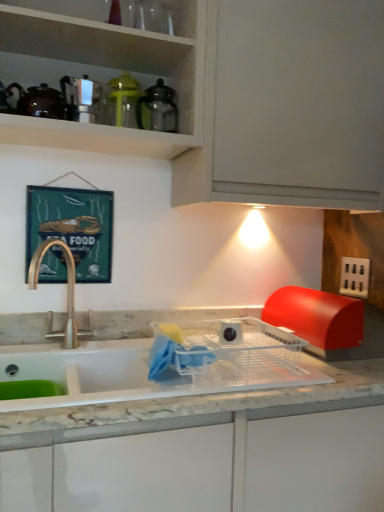
What do you see at coordinates (158, 108) in the screenshot?
I see `transparent glass pitcher at upper center, the third appliance positioned from the left` at bounding box center [158, 108].

Measure the distance between satin nickel soap dispenser at upper left, the 1th appliance when ordered from left to right, and camera.

satin nickel soap dispenser at upper left, the 1th appliance when ordered from left to right, is 4.12 feet from camera.

Locate an element on the screen. The height and width of the screenshot is (512, 384). translucent yellow pitcher at upper center, the second appliance positioned from the right is located at coordinates pos(123,101).

The height and width of the screenshot is (512, 384). What do you see at coordinates (147, 369) in the screenshot?
I see `white glossy sink at center` at bounding box center [147, 369].

Identify the location of matte brown teapot at upper left. Image resolution: width=384 pixels, height=512 pixels. (39, 101).

At what (x,y) coordinates should I click in order to perform the action: click on transparent glass pitcher at upper center, the third appliance positioned from the left. Please return your answer as a coordinate pair (x, y). The image size is (384, 512). Looking at the image, I should click on (158, 108).

Is white matte cabinet at upper center positioned with its back to transparent glass pitcher at upper center, the third appliance positioned from the left?

Yes.

Is white matte cabinet at upper center positioned far away from transparent glass pitcher at upper center, which is the 1th appliance from right to left?

No, there isn't a large distance between white matte cabinet at upper center and transparent glass pitcher at upper center, which is the 1th appliance from right to left.

Can you confirm if white matte cabinet at upper center is thinner than transparent glass pitcher at upper center, which is the 1th appliance from right to left?

Incorrect, the width of white matte cabinet at upper center is not less than that of transparent glass pitcher at upper center, which is the 1th appliance from right to left.

Based on their positions, is black plastic electric outlet at right located to the left or right of matte brown teapot at upper left?

From the image, it's evident that black plastic electric outlet at right is to the right of matte brown teapot at upper left.

The width and height of the screenshot is (384, 512). In order to click on electric outlet located on the right of matte brown teapot at upper left in this screenshot , I will do `click(354, 277)`.

Consider the image. Can you see black plastic electric outlet at right touching matte brown teapot at upper left?

No, black plastic electric outlet at right is not next to matte brown teapot at upper left.

From a real-world perspective, who is located higher, black plastic electric outlet at right or matte brown teapot at upper left?

From a 3D spatial view, matte brown teapot at upper left is above.

Is white matte cabinet at upper center next to satin nickel soap dispenser at upper left, the 1th appliance when ordered from left to right, and touching it?

No, white matte cabinet at upper center is not touching satin nickel soap dispenser at upper left, the 1th appliance when ordered from left to right.

Who is smaller, white matte cabinet at upper center or satin nickel soap dispenser at upper left, the 3th appliance in the right-to-left sequence?

satin nickel soap dispenser at upper left, the 3th appliance in the right-to-left sequence, is smaller.

How different are the orientations of white matte cabinet at upper center and satin nickel soap dispenser at upper left, the 1th appliance when ordered from left to right, in degrees?

The angular difference between white matte cabinet at upper center and satin nickel soap dispenser at upper left, the 1th appliance when ordered from left to right, is 0.0657 degrees.

Is satin nickel soap dispenser at upper left, the 3th appliance in the right-to-left sequence, at the back of white matte cabinet at upper center?

Yes.

Is black plastic electric outlet at right oriented towards transparent glass pitcher at upper center, the third appliance positioned from the left?

No, black plastic electric outlet at right is not facing towards transparent glass pitcher at upper center, the third appliance positioned from the left.

Where is `electric outlet behind the transparent glass pitcher at upper center, which is the 1th appliance from right to left`? The height and width of the screenshot is (512, 384). electric outlet behind the transparent glass pitcher at upper center, which is the 1th appliance from right to left is located at coordinates (354, 277).

From the image's perspective, is black plastic electric outlet at right located above or below transparent glass pitcher at upper center, the third appliance positioned from the left?

Based on their image positions, black plastic electric outlet at right is located beneath transparent glass pitcher at upper center, the third appliance positioned from the left.

Based on their positions, is black plastic electric outlet at right located to the left or right of translucent yellow pitcher at upper center, the second appliance positioned from the right?

From the image, it's evident that black plastic electric outlet at right is to the right of translucent yellow pitcher at upper center, the second appliance positioned from the right.

Looking at this image, what's the angular difference between black plastic electric outlet at right and translucent yellow pitcher at upper center, the second appliance positioned from the right,'s facing directions?

The facing directions of black plastic electric outlet at right and translucent yellow pitcher at upper center, the second appliance positioned from the right, are 90.4 degrees apart.

Which is nearer, (358, 284) or (110, 82)?

Point (110, 82)

Could you measure the distance between black plastic electric outlet at right and translucent yellow pitcher at upper center, the second appliance positioned from the right?

A distance of 38.46 inches exists between black plastic electric outlet at right and translucent yellow pitcher at upper center, the second appliance positioned from the right.

From the image's perspective, is transparent glass pitcher at upper center, the third appliance positioned from the left, above or below translucent yellow pitcher at upper center, which is counted as the 2th appliance, starting from the left?

Clearly, from the image's perspective, transparent glass pitcher at upper center, the third appliance positioned from the left, is below translucent yellow pitcher at upper center, which is counted as the 2th appliance, starting from the left.

Is transparent glass pitcher at upper center, the third appliance positioned from the left, turned away from translucent yellow pitcher at upper center, which is counted as the 2th appliance, starting from the left?

transparent glass pitcher at upper center, the third appliance positioned from the left, is not turned away from translucent yellow pitcher at upper center, which is counted as the 2th appliance, starting from the left.

Which is correct: transparent glass pitcher at upper center, which is the 1th appliance from right to left, is inside translucent yellow pitcher at upper center, the second appliance positioned from the right, or outside of it?

transparent glass pitcher at upper center, which is the 1th appliance from right to left, is not enclosed by translucent yellow pitcher at upper center, the second appliance positioned from the right.

Which object is more forward, transparent glass pitcher at upper center, the third appliance positioned from the left, or translucent yellow pitcher at upper center, the second appliance positioned from the right?

transparent glass pitcher at upper center, the third appliance positioned from the left.

How much distance is there between transparent glass pitcher at upper center, which is the 1th appliance from right to left, and black plastic electric outlet at right?

transparent glass pitcher at upper center, which is the 1th appliance from right to left, is 33.99 inches away from black plastic electric outlet at right.

Is transparent glass pitcher at upper center, the third appliance positioned from the left, not near black plastic electric outlet at right?

No, there isn't a large distance between transparent glass pitcher at upper center, the third appliance positioned from the left, and black plastic electric outlet at right.

From their relative heights in the image, would you say transparent glass pitcher at upper center, the third appliance positioned from the left, is taller or shorter than black plastic electric outlet at right?

Clearly, transparent glass pitcher at upper center, the third appliance positioned from the left, is taller compared to black plastic electric outlet at right.

Between transparent glass pitcher at upper center, which is the 1th appliance from right to left, and black plastic electric outlet at right, which one has smaller width?

black plastic electric outlet at right.

This screenshot has width=384, height=512. I want to click on cabinetry that is on the right side of transparent glass pitcher at upper center, the third appliance positioned from the left, so (250, 93).

Find the location of a particular element. Image resolution: width=384 pixels, height=512 pixels. tea pot above the black plastic electric outlet at right (from a real-world perspective) is located at coordinates (39, 101).

Based on their spatial positions, is satin nickel soap dispenser at upper left, the 3th appliance in the right-to-left sequence, or white glossy sink at center closer to matte brown teapot at upper left?

satin nickel soap dispenser at upper left, the 3th appliance in the right-to-left sequence, is positioned closer to the anchor matte brown teapot at upper left.

From the image, which object appears to be nearer to white matte cabinet at upper center, translucent yellow pitcher at upper center, the second appliance positioned from the right, or satin nickel soap dispenser at upper left, the 1th appliance when ordered from left to right?

translucent yellow pitcher at upper center, the second appliance positioned from the right, is closer to white matte cabinet at upper center.

Looking at the image, which one is located closer to matte brown teapot at upper left, black plastic electric outlet at right or white matte cabinet at upper center?

The object closer to matte brown teapot at upper left is white matte cabinet at upper center.

Considering their positions, is white glossy sink at center positioned further to transparent glass pitcher at upper center, the third appliance positioned from the left, than satin nickel soap dispenser at upper left, the 3th appliance in the right-to-left sequence?

white glossy sink at center is positioned further to the anchor transparent glass pitcher at upper center, the third appliance positioned from the left.

Estimate the real-world distances between objects in this image. Which object is further from matte brown teapot at upper left, translucent yellow pitcher at upper center, the second appliance positioned from the right, or satin nickel soap dispenser at upper left, the 1th appliance when ordered from left to right?

Based on the image, translucent yellow pitcher at upper center, the second appliance positioned from the right, appears to be further to matte brown teapot at upper left.

Considering their positions, is matte brown teapot at upper left positioned further to white matte cabinet at upper center than satin nickel soap dispenser at upper left, the 1th appliance when ordered from left to right?

The object further to white matte cabinet at upper center is matte brown teapot at upper left.

Based on their spatial positions, is translucent yellow pitcher at upper center, the second appliance positioned from the right, or white matte cabinet at upper center further from transparent glass pitcher at upper center, the third appliance positioned from the left?

Based on the image, white matte cabinet at upper center appears to be further to transparent glass pitcher at upper center, the third appliance positioned from the left.

From the picture: When comparing their distances from transparent glass pitcher at upper center, which is the 1th appliance from right to left, does translucent yellow pitcher at upper center, the second appliance positioned from the right, or black plastic electric outlet at right seem closer?

Based on the image, translucent yellow pitcher at upper center, the second appliance positioned from the right, appears to be nearer to transparent glass pitcher at upper center, which is the 1th appliance from right to left.

Where is `tea pot that lies between transparent glass pitcher at upper center, the third appliance positioned from the left, and white glossy sink at center from top to bottom`? tea pot that lies between transparent glass pitcher at upper center, the third appliance positioned from the left, and white glossy sink at center from top to bottom is located at coordinates (39, 101).

Image resolution: width=384 pixels, height=512 pixels. What are the coordinates of `tea pot between satin nickel soap dispenser at upper left, the 3th appliance in the right-to-left sequence, and white glossy sink at center, in the vertical direction` in the screenshot? It's located at (39, 101).

Locate an element on the screen. The height and width of the screenshot is (512, 384). appliance between translucent yellow pitcher at upper center, the second appliance positioned from the right, and black plastic electric outlet at right, in the horizontal direction is located at coordinates (158, 108).

Image resolution: width=384 pixels, height=512 pixels. Identify the location of tea pot that lies between white matte cabinet at upper center and white glossy sink at center from top to bottom. (39, 101).